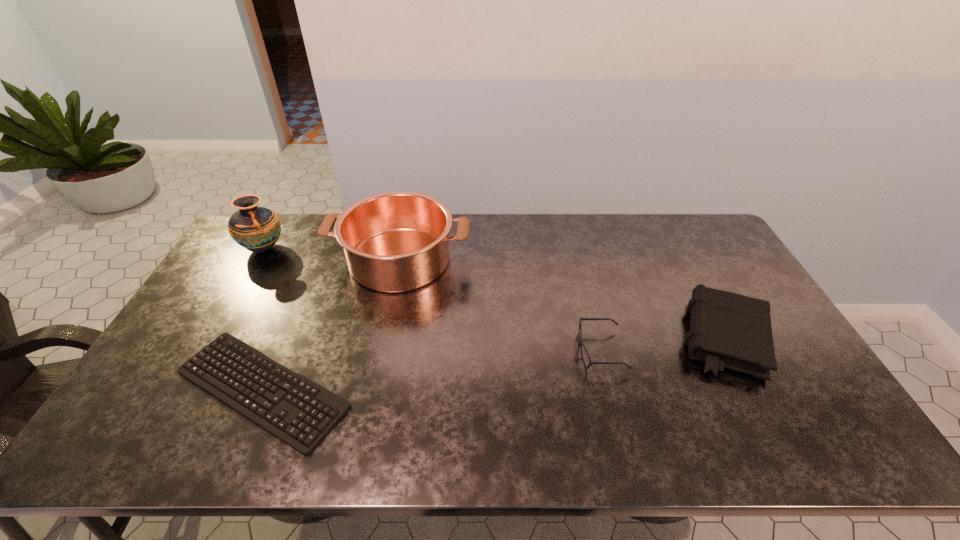
Where is `vacant point that satisfies the following two spatial constraints: 1. on the front side of the rightmost object; 2. on the left side of the saucepan`? This screenshot has width=960, height=540. vacant point that satisfies the following two spatial constraints: 1. on the front side of the rightmost object; 2. on the left side of the saucepan is located at coordinates click(x=384, y=337).